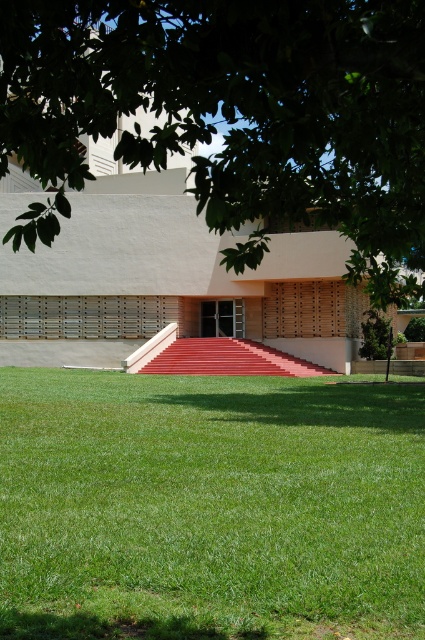
Is point (215, 188) more distant than point (249, 362)?

No.

Who is positioned more to the left, green leafy tree at upper center or red carpeted stairs at center?

green leafy tree at upper center

Does point (79, 88) come farther from viewer compared to point (161, 358)?

That is False.

Where is `green leafy tree at upper center`? green leafy tree at upper center is located at coordinates (232, 113).

Can you confirm if green grass at lower center is positioned to the right of green leafy tree at upper center?

Correct, you'll find green grass at lower center to the right of green leafy tree at upper center.

Consider the image. Does green grass at lower center appear over green leafy tree at upper center?

Actually, green grass at lower center is below green leafy tree at upper center.

This screenshot has height=640, width=425. In order to click on green grass at lower center in this screenshot , I will do [209, 506].

Find the location of a particular element. Image resolution: width=425 pixels, height=640 pixels. green grass at lower center is located at coordinates (209, 506).

Between point (334, 513) and point (272, 374), which one is positioned in front?

Positioned in front is point (334, 513).

Which of these two, green grass at lower center or red carpeted stairs at center, stands shorter?

With less height is green grass at lower center.

Is point (240, 456) farther from viewer compared to point (156, 371)?

That is False.

At what (x,y) coordinates should I click in order to perform the action: click on green grass at lower center. Please return your answer as a coordinate pair (x, y). Looking at the image, I should click on (209, 506).